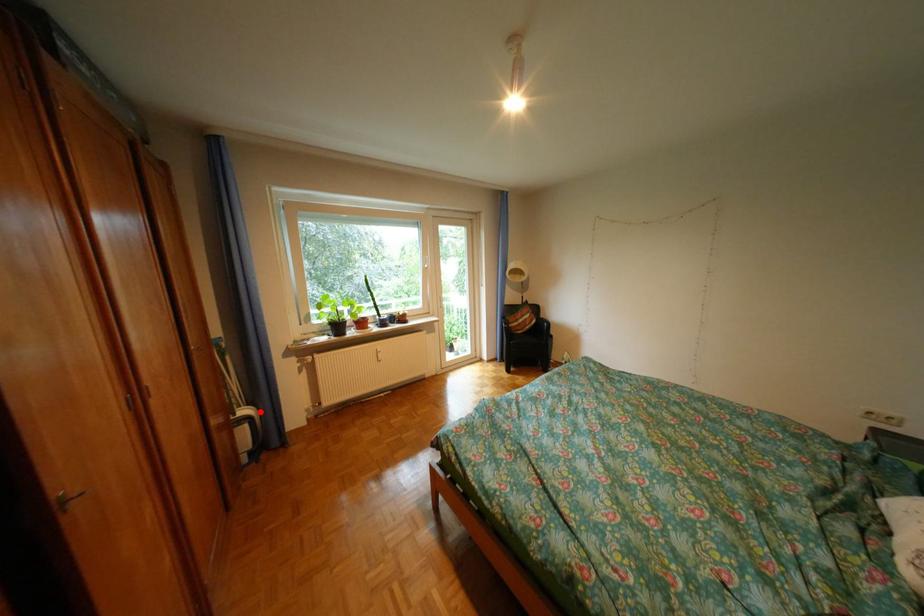
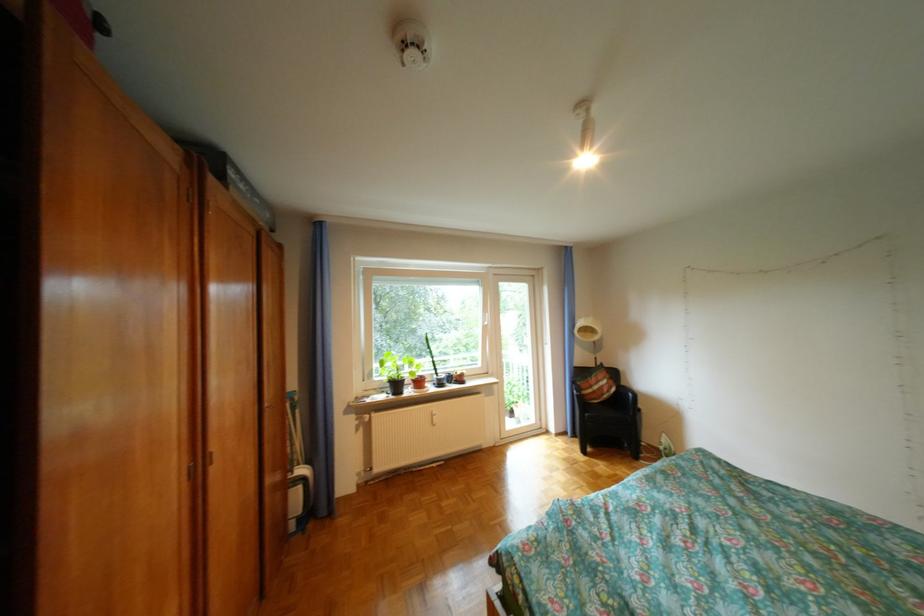
Locate, in the second image, the point that corresponds to the highlighted location in the first image.

(317, 471)